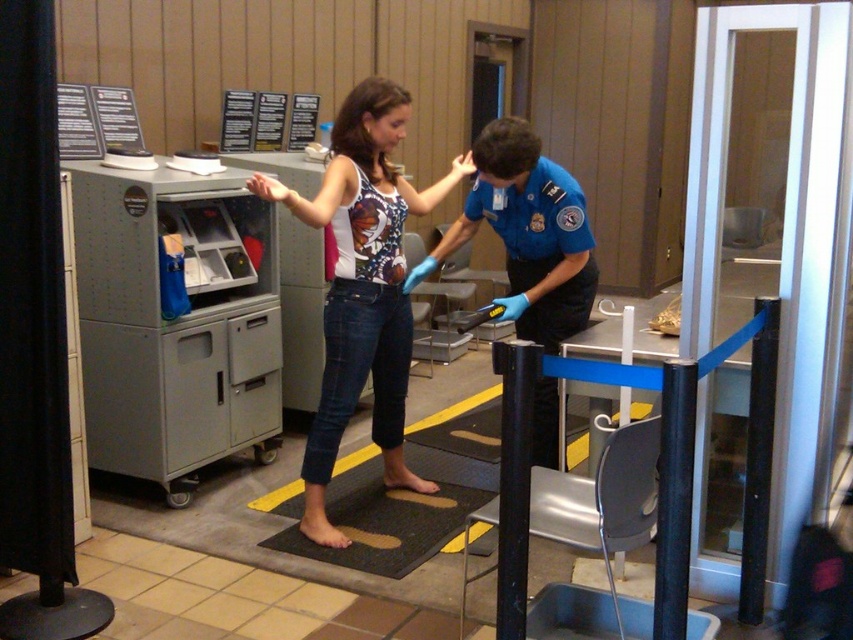
In the scene shown: Is matte white tank top at center shorter than blue uniform at center?

Incorrect, matte white tank top at center's height does not fall short of blue uniform at center's.

Between point (314, 492) and point (447, 248), which one is positioned behind?

Positioned behind is point (447, 248).

Locate an element on the screen. matte white tank top at center is located at coordinates (363, 285).